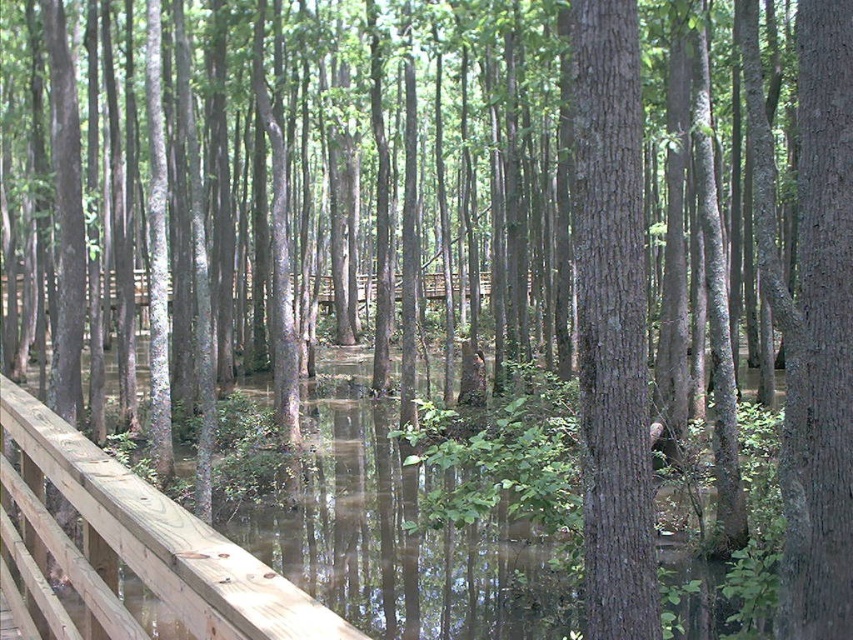
Is smooth brown tree trunk at center to the left of light brown wooden rail at left from the viewer's perspective?

Incorrect, smooth brown tree trunk at center is not on the left side of light brown wooden rail at left.

Between point (590, 168) and point (25, 618), which one is positioned behind?

The point (590, 168) is behind.

The height and width of the screenshot is (640, 853). I want to click on smooth brown tree trunk at center, so click(x=611, y=321).

Is point (38, 532) farther from viewer compared to point (839, 298)?

That is False.

Which is in front, point (44, 561) or point (827, 145)?

Point (44, 561)

Where is `light brown wooden rail at left`? light brown wooden rail at left is located at coordinates (128, 547).

How distant is smooth brown tree trunk at center from smooth brown tree trunk at center-right?

They are 4.83 feet apart.

Does smooth brown tree trunk at center come in front of smooth brown tree trunk at center-right?

Yes.

Find the location of a particular element. Image resolution: width=853 pixels, height=640 pixels. smooth brown tree trunk at center is located at coordinates (611, 321).